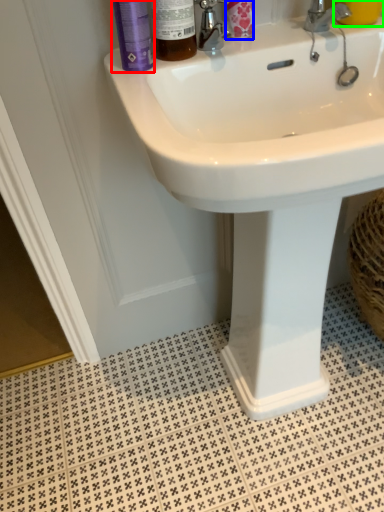
Question: Considering the real-world distances, which object is farthest from mouthwash (highlighted by a red box)? toiletry (highlighted by a blue box) or liquid (highlighted by a green box)?

Choices:
 (A) toiletry
 (B) liquid

Answer: (B)